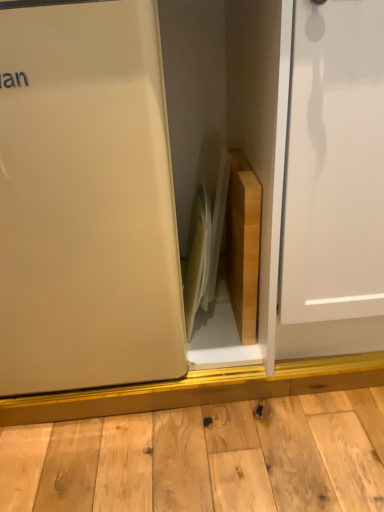
Find the location of a particular element. The height and width of the screenshot is (512, 384). matte white refrigerator at left is located at coordinates (86, 200).

This screenshot has height=512, width=384. What do you see at coordinates (86, 200) in the screenshot?
I see `matte white refrigerator at left` at bounding box center [86, 200].

Identify the location of matte white refrigerator at left. The image size is (384, 512). (86, 200).